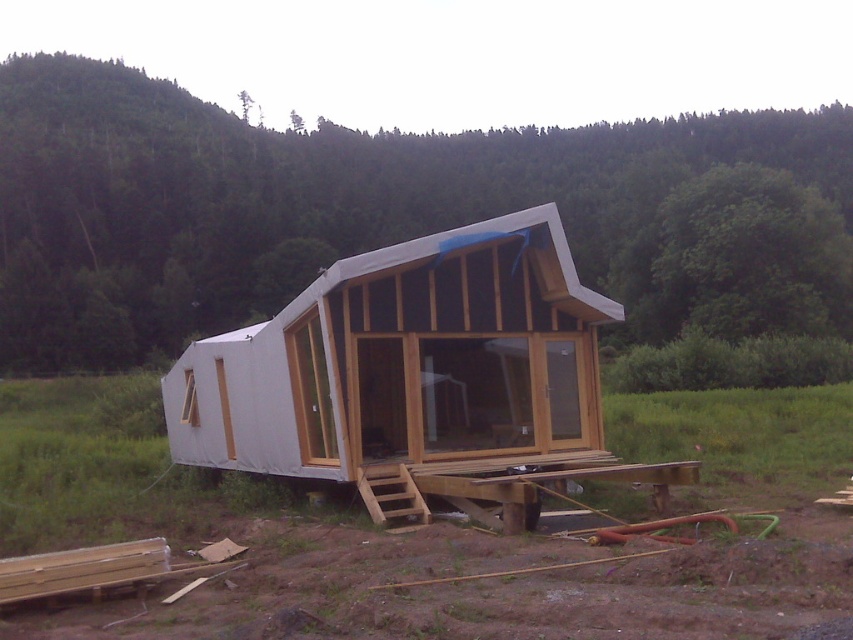
Which is more to the right, transparent glass door at center or transparent glass window at center?

Positioned to the right is transparent glass door at center.

Can you confirm if transparent glass door at center is smaller than transparent glass window at center?

No, transparent glass door at center is not smaller than transparent glass window at center.

Between point (556, 349) and point (183, 404), which one is positioned behind?

The point (183, 404) is behind.

I want to click on transparent glass door at center, so click(x=563, y=388).

Is white matte cabin at center thinner than clear glass door at center?

Incorrect, white matte cabin at center's width is not less than clear glass door at center's.

Can you confirm if white matte cabin at center is bigger than clear glass door at center?

Indeed, white matte cabin at center has a larger size compared to clear glass door at center.

In order to click on white matte cabin at center in this screenshot , I will do `click(416, 378)`.

Where is `white matte cabin at center`? white matte cabin at center is located at coordinates (416, 378).

Is clear glass door at center in front of transparent glass window at center?

Yes, clear glass door at center is in front of transparent glass window at center.

Is clear glass door at center positioned behind transparent glass window at center?

No, clear glass door at center is in front of transparent glass window at center.

Image resolution: width=853 pixels, height=640 pixels. Find the location of `clear glass door at center`. clear glass door at center is located at coordinates (311, 388).